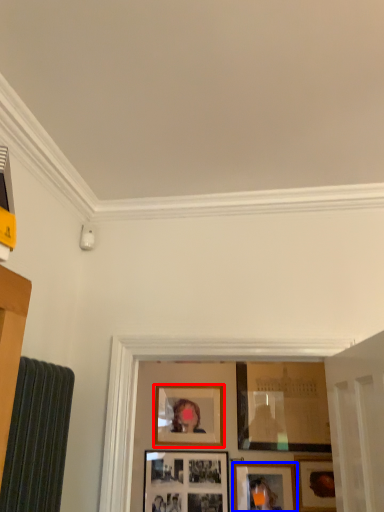
Question: Among these objects, which one is nearest to the camera, picture frame (highlighted by a red box) or picture frame (highlighted by a blue box)?

Choices:
 (A) picture frame
 (B) picture frame

Answer: (B)